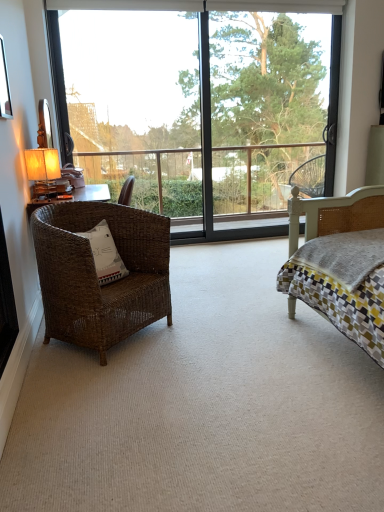
Question: Can you confirm if brown wicker chair at left is positioned to the left of transparent glass window at center?

Choices:
 (A) yes
 (B) no

Answer: (A)

Question: Is brown wicker chair at left positioned with its back to transparent glass window at center?

Choices:
 (A) yes
 (B) no

Answer: (B)

Question: Is brown wicker chair at left touching transparent glass window at center?

Choices:
 (A) yes
 (B) no

Answer: (B)

Question: Can you confirm if brown wicker chair at left is thinner than transparent glass window at center?

Choices:
 (A) yes
 (B) no

Answer: (B)

Question: Considering the relative positions of brown wicker chair at left and transparent glass window at center in the image provided, is brown wicker chair at left to the right of transparent glass window at center from the viewer's perspective?

Choices:
 (A) yes
 (B) no

Answer: (B)

Question: Does brown wicker chair at left have a lesser height compared to transparent glass window at center?

Choices:
 (A) yes
 (B) no

Answer: (A)

Question: Does transparent glass window at center turn towards brown wicker chair at left?

Choices:
 (A) no
 (B) yes

Answer: (B)

Question: Is transparent glass window at center positioned in front of brown wicker chair at left?

Choices:
 (A) no
 (B) yes

Answer: (A)

Question: Is transparent glass window at center facing away from brown wicker chair at left?

Choices:
 (A) no
 (B) yes

Answer: (A)

Question: Is transparent glass window at center at the right side of brown wicker chair at left?

Choices:
 (A) yes
 (B) no

Answer: (A)

Question: Does transparent glass window at center have a lesser width compared to brown wicker chair at left?

Choices:
 (A) no
 (B) yes

Answer: (B)

Question: Does transparent glass window at center have a lesser height compared to brown wicker chair at left?

Choices:
 (A) no
 (B) yes

Answer: (A)

Question: Is green leafy tree at upper center aimed at transparent glass window at center?

Choices:
 (A) yes
 (B) no

Answer: (A)